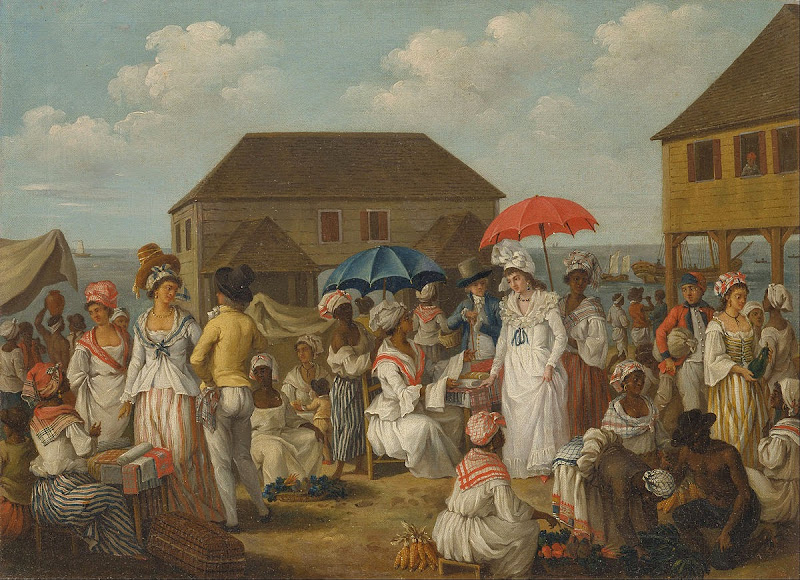
What are the coordinates of `window` in the screenshot? It's located at (702, 159), (745, 157), (789, 150), (380, 227), (330, 229), (186, 241), (177, 241).